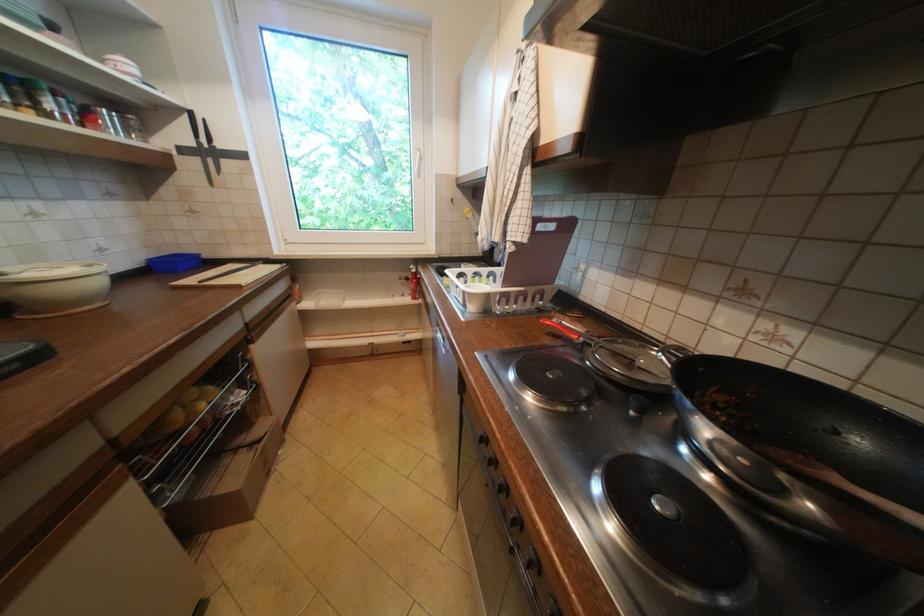
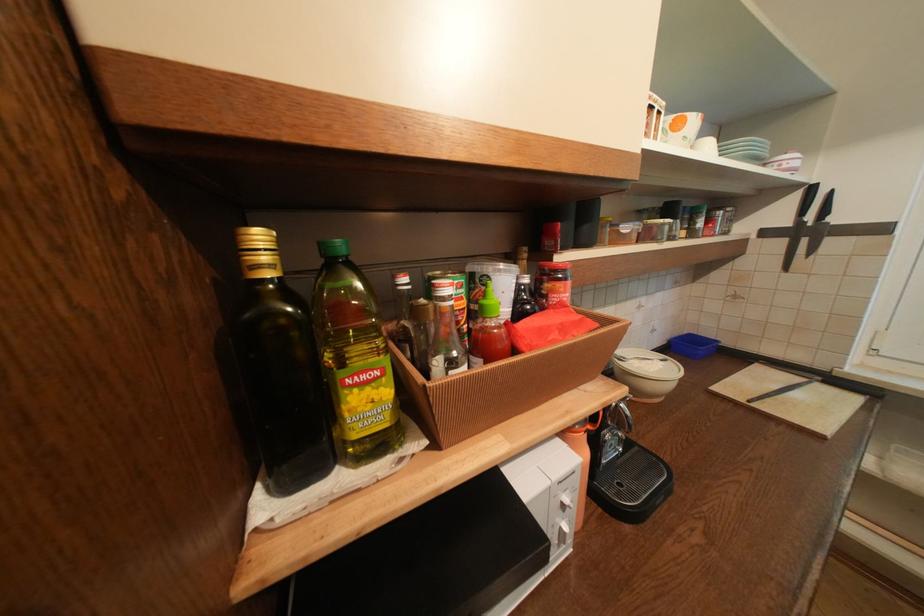
The point at (195, 119) is marked in the first image. Where is the corresponding point in the second image?

(807, 196)